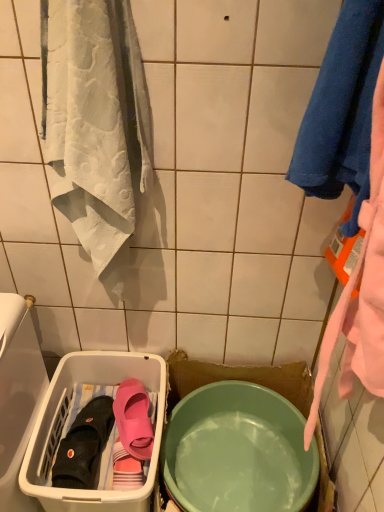
Question: Is pink rubber slipper at lower left, which is the 1th footwear in right-to-left order, bigger than matte green bowl at center?

Choices:
 (A) yes
 (B) no

Answer: (B)

Question: From the image's perspective, is pink rubber slipper at lower left, which is the 2th footwear in left-to-right order, beneath matte green bowl at center?

Choices:
 (A) no
 (B) yes

Answer: (A)

Question: From the image's perspective, is pink rubber slipper at lower left, which is the 2th footwear in left-to-right order, on matte green bowl at center?

Choices:
 (A) yes
 (B) no

Answer: (A)

Question: From a real-world perspective, is pink rubber slipper at lower left, which is the 1th footwear in right-to-left order, positioned over matte green bowl at center based on gravity?

Choices:
 (A) yes
 (B) no

Answer: (A)

Question: Is pink rubber slipper at lower left, which is the 1th footwear in right-to-left order, not near matte green bowl at center?

Choices:
 (A) yes
 (B) no

Answer: (B)

Question: Does pink rubber slipper at lower left, which is the 2th footwear in left-to-right order, appear on the left side of matte green bowl at center?

Choices:
 (A) no
 (B) yes

Answer: (B)

Question: Can you confirm if blue soft towel at upper right is positioned to the right of white plastic laundry basket at lower left?

Choices:
 (A) yes
 (B) no

Answer: (A)

Question: Can you confirm if blue soft towel at upper right is taller than white plastic laundry basket at lower left?

Choices:
 (A) yes
 (B) no

Answer: (B)

Question: Can you confirm if blue soft towel at upper right is thinner than white plastic laundry basket at lower left?

Choices:
 (A) no
 (B) yes

Answer: (B)

Question: From a real-world perspective, is blue soft towel at upper right on top of white plastic laundry basket at lower left?

Choices:
 (A) yes
 (B) no

Answer: (A)

Question: Can you confirm if blue soft towel at upper right is positioned to the left of white plastic laundry basket at lower left?

Choices:
 (A) yes
 (B) no

Answer: (B)

Question: Can you confirm if blue soft towel at upper right is shorter than white plastic laundry basket at lower left?

Choices:
 (A) no
 (B) yes

Answer: (B)

Question: Is pink rubber slipper at lower left, which is the 2th footwear in left-to-right order, next to white plastic laundry basket at lower left?

Choices:
 (A) yes
 (B) no

Answer: (B)